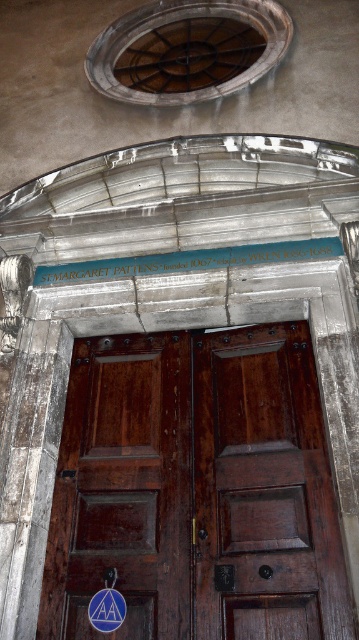
Who is higher up, dark brown wood door at center or black stone inscription at center?

black stone inscription at center

You are a GUI agent. You are given a task and a screenshot of the screen. Output one action in this format:
    pyautogui.click(x=<x>, y=<y>)
    Task: Click on the dark brown wood door at center
    
    Given the screenshot: What is the action you would take?
    pyautogui.click(x=197, y=490)